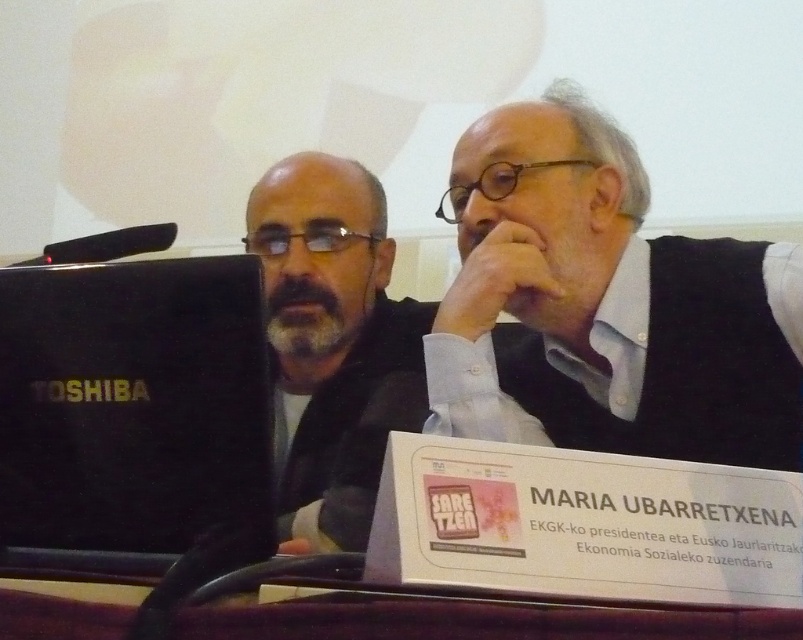
Question: Can you confirm if black matte laptop at left is bigger than matte black laptop at left?

Choices:
 (A) yes
 (B) no

Answer: (B)

Question: Which of the following is the farthest from the observer?

Choices:
 (A) gray beard at center
 (B) matte black laptop at left

Answer: (A)

Question: Is black matte laptop at left positioned in front of gray beard at center?

Choices:
 (A) yes
 (B) no

Answer: (A)

Question: Is black matte laptop at left closer to the viewer compared to gray beard at center?

Choices:
 (A) yes
 (B) no

Answer: (A)

Question: Which of these objects is positioned closest to the matte black laptop at left?

Choices:
 (A) black matte laptop at left
 (B) gray beard at center

Answer: (B)

Question: Which point is closer to the camera taking this photo?

Choices:
 (A) (280, 284)
 (B) (344, 516)
 (C) (27, 513)

Answer: (C)